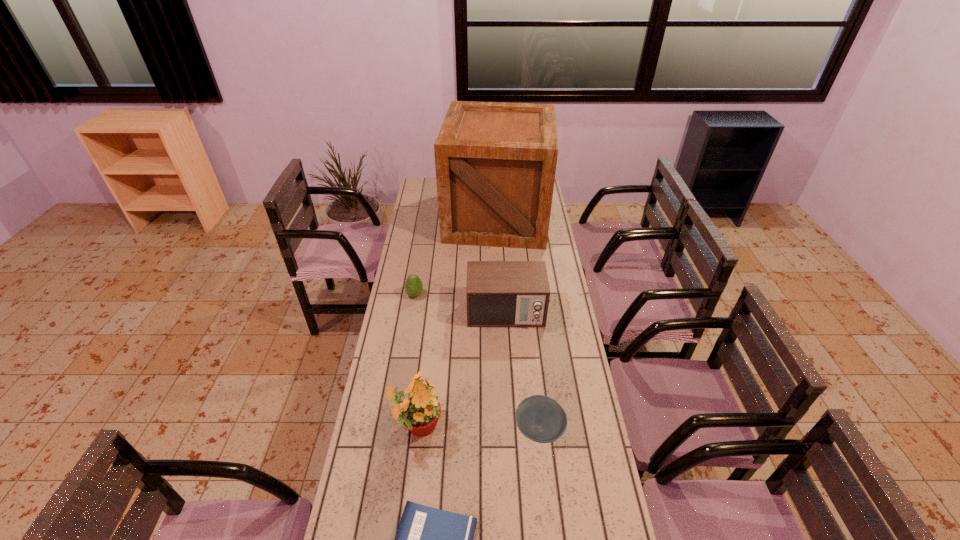
At what (x,y) coordinates should I click in order to perform the action: click on the tallest object. Please return your answer as a coordinate pair (x, y). Looking at the image, I should click on (495, 162).

Identify the location of the farthest object. (495, 162).

Locate an element on the screen. This screenshot has height=540, width=960. the fifth shortest object is located at coordinates (419, 411).

Find the location of a particular element. radio receiver is located at coordinates (499, 293).

The width and height of the screenshot is (960, 540). I want to click on the third shortest object, so click(x=413, y=286).

At what (x,y) coordinates should I click in order to perform the action: click on the second shortest object. Please return your answer as a coordinate pair (x, y). Looking at the image, I should click on (540, 418).

You are a GUI agent. You are given a task and a screenshot of the screen. Output one action in this format:
    pyautogui.click(x=<x>, y=<y>)
    Task: Click on the vacant space located 0.300m on the front of the farthest object
    
    Given the screenshot: What is the action you would take?
    pyautogui.click(x=500, y=291)

Identify the location of vacant space located 0.250m on the back of the flowerpot. (427, 345).

What are the coordinates of `blank space located on the front-facing side of the fourth shortest object` in the screenshot? It's located at click(509, 369).

Where is `vacant space located on the back of the fourth tallest object`? This screenshot has width=960, height=540. vacant space located on the back of the fourth tallest object is located at coordinates pyautogui.click(x=421, y=254).